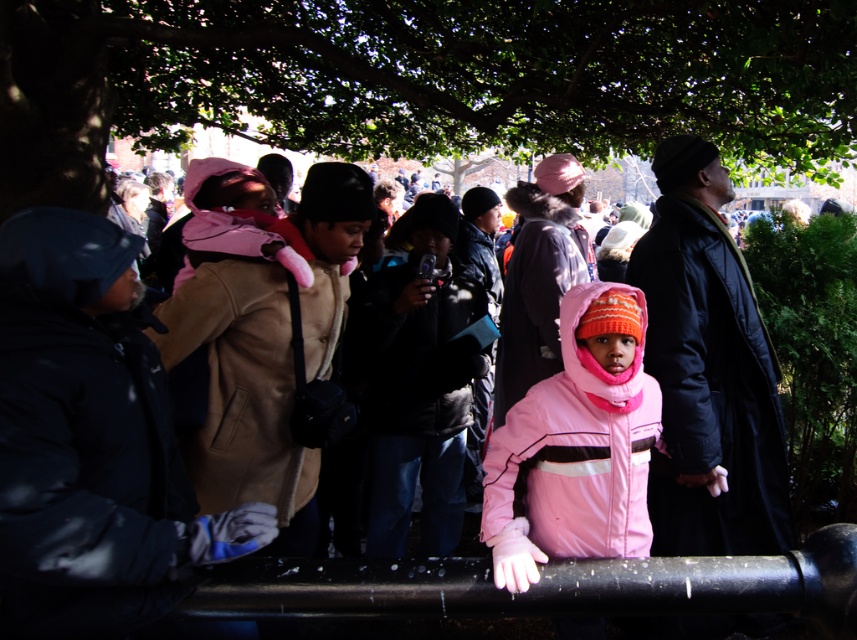
From the picture: You are a photographer trying to capture a clear shot of both the tan leather jacket at center and the dark brown leather jacket at center. Since you want both jackets to be fully visible in your photo, which jacket should you focus on first to ensure it fits in the frame?

The tan leather jacket at center is much taller than the dark brown leather jacket at center, so you should focus on ensuring the taller tan leather jacket at center fits first to capture both in the frame.

Looking at the two jackets in the scene, the pink fleece jacket at center and the dark brown leather jacket at center, which one is positioned to the right of the other?

The pink fleece jacket at center is to the right of the dark brown leather jacket at center.